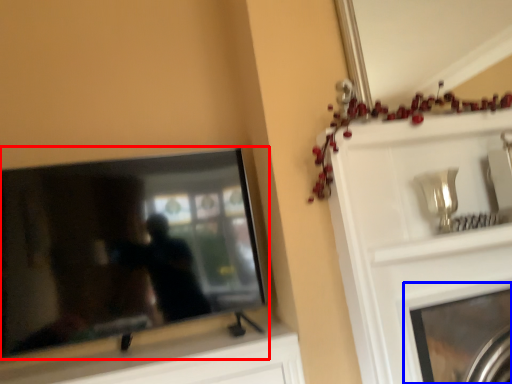
Question: Among these objects, which one is farthest to the camera, television (highlighted by a red box) or fireplace (highlighted by a blue box)?

Choices:
 (A) television
 (B) fireplace

Answer: (B)